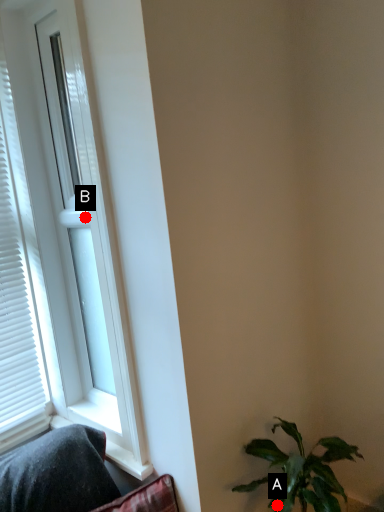
Question: Two points are circled on the image, labeled by A and B beside each circle. Which point is further to the camera?

Choices:
 (A) A is further
 (B) B is further

Answer: (B)